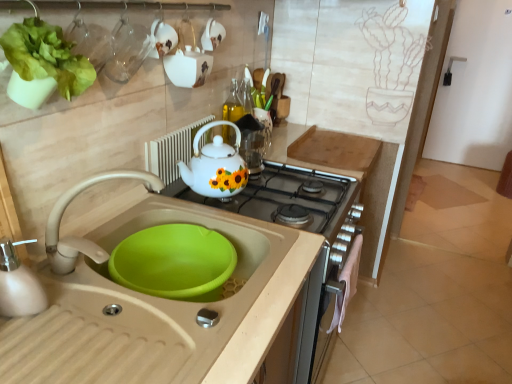
In order to face white matte soap dispenser at left, should I rotate leftwards or rightwards?

To align with it, rotate left about 29.166°.

Describe the element at coordinates (285, 196) in the screenshot. I see `white glossy gas stove at center` at that location.

In order to face white glossy teapot at upper center, the first appliance when ordered from top to bottom, should I rotate leftwards or rightwards?

Rotate left and turn 8.757 degrees.

The height and width of the screenshot is (384, 512). Describe the element at coordinates (172, 151) in the screenshot. I see `white ceramic teapot at upper center, placed as the 1th appliance when sorted from bottom to top` at that location.

Locate an element on the screen. The height and width of the screenshot is (384, 512). transparent glass cup at upper left is located at coordinates (127, 51).

At what (x,y) coordinates should I click in order to perform the action: click on white glossy teapot at center. Please return your answer as a coordinate pair (x, y). Image resolution: width=512 pixels, height=384 pixels. Looking at the image, I should click on (216, 166).

What is the approximate width of green leafy lettuce at upper left?

green leafy lettuce at upper left is 5.08 inches wide.

What do you see at coordinates (428, 321) in the screenshot? I see `beige tile at lower right` at bounding box center [428, 321].

Identify the location of white matte soap dispenser at left. The image size is (512, 384). (18, 284).

You are a GUI agent. You are given a task and a screenshot of the screen. Output one action in this format:
    pyautogui.click(x=<x>, y=<y>)
    Task: Click on the vegetable above the white matte soap dispenser at left (from a real-world perspective)
    The image size is (512, 384).
    Given the screenshot: What is the action you would take?
    pyautogui.click(x=46, y=56)

From the image's perspective, is white matte soap dispenser at left on top of green leafy lettuce at upper left?

No, from the image's perspective, white matte soap dispenser at left is not above green leafy lettuce at upper left.

How distant is white matte soap dispenser at left from green leafy lettuce at upper left?

white matte soap dispenser at left is 37.71 centimeters from green leafy lettuce at upper left.

From a real-world perspective, between white matte soap dispenser at left and green leafy lettuce at upper left, who is vertically higher?

In real-world perspective, green leafy lettuce at upper left is above.

Is point (233, 376) positioned behind point (180, 70)?

No.

Can you confirm if beige plastic sink at lower left is positioned to the left of white glossy teapot at upper center, the first appliance when ordered from top to bottom?

Correct, you'll find beige plastic sink at lower left to the left of white glossy teapot at upper center, the first appliance when ordered from top to bottom.

Image resolution: width=512 pixels, height=384 pixels. I want to click on appliance that is on the right side of beige plastic sink at lower left, so tap(187, 59).

Is beige plastic sink at lower left located outside white glossy teapot at upper center, the first appliance when ordered from top to bottom?

Yes, beige plastic sink at lower left is located beyond the bounds of white glossy teapot at upper center, the first appliance when ordered from top to bottom.

From the image's perspective, which is above, white matte soap dispenser at left or transparent glass cup at upper left?

transparent glass cup at upper left.

Does point (1, 246) appear closer or farther from the camera than point (119, 70)?

Point (1, 246) appears to be closer to the viewer than point (119, 70).

Would you say white matte soap dispenser at left is outside transparent glass cup at upper left?

white matte soap dispenser at left is positioned outside transparent glass cup at upper left.

Considering the sizes of white matte soap dispenser at left and transparent glass cup at upper left in the image, is white matte soap dispenser at left taller or shorter than transparent glass cup at upper left?

Clearly, white matte soap dispenser at left is shorter compared to transparent glass cup at upper left.

Considering the positions of objects beige tile at lower right and transparent glass cup at upper left in the image provided, who is more to the left, beige tile at lower right or transparent glass cup at upper left?

Positioned to the left is transparent glass cup at upper left.

Is beige tile at lower right oriented towards transparent glass cup at upper left?

No, beige tile at lower right is not oriented towards transparent glass cup at upper left.

From the image's perspective, which object appears higher, beige tile at lower right or transparent glass cup at upper left?

transparent glass cup at upper left, from the image's perspective.

Who is taller, beige tile at lower right or transparent glass cup at upper left?

transparent glass cup at upper left is taller.

Is white glossy teapot at upper center, the first appliance when ordered from top to bottom, facing away from beige plastic sink at lower left?

No, beige plastic sink at lower left is not at the back of white glossy teapot at upper center, the first appliance when ordered from top to bottom.

From a real-world perspective, is white glossy teapot at upper center, which is the second appliance in bottom-to-top order, beneath beige plastic sink at lower left?

No.

Are white glossy teapot at upper center, which is the second appliance in bottom-to-top order, and beige plastic sink at lower left beside each other?

No, white glossy teapot at upper center, which is the second appliance in bottom-to-top order, is not beside beige plastic sink at lower left.

How far apart are white glossy teapot at upper center, the first appliance when ordered from top to bottom, and beige plastic sink at lower left?

white glossy teapot at upper center, the first appliance when ordered from top to bottom, and beige plastic sink at lower left are 24.72 inches apart.

Can you confirm if beige tile at lower right is wider than matte beige faucet at sink left?

Correct, the width of beige tile at lower right exceeds that of matte beige faucet at sink left.

From a real-world perspective, who is located lower, beige tile at lower right or matte beige faucet at sink left?

beige tile at lower right, from a real-world perspective.

Is beige tile at lower right facing away from matte beige faucet at sink left?

That's not correct — beige tile at lower right is not looking away from matte beige faucet at sink left.

Could you tell me if white matte soap dispenser at left is turned towards matte beige faucet at sink left?

No, white matte soap dispenser at left is not turned towards matte beige faucet at sink left.

Does point (33, 284) lie in front of point (102, 180)?

Yes.

Do you think white matte soap dispenser at left is within matte beige faucet at sink left, or outside of it?

white matte soap dispenser at left is outside matte beige faucet at sink left.

Is white matte soap dispenser at left next to matte beige faucet at sink left and touching it?

No, white matte soap dispenser at left is not next to matte beige faucet at sink left.

Identify the location of kitchen appliance located below the green leafy lettuce at upper left (from the image's perspective). The height and width of the screenshot is (384, 512). (18, 284).

You are a GUI agent. You are given a task and a screenshot of the screen. Output one action in this format:
    pyautogui.click(x=<x>, y=<y>)
    Task: Click on the sink in front of the white glossy teapot at upper center, which is the second appliance in bottom-to-top order
    This screenshot has height=384, width=512.
    Given the screenshot: What is the action you would take?
    pyautogui.click(x=157, y=306)

From the picture: Which object lies nearer to the anchor point matte beige faucet at sink left, white ceramic teapot at upper center, placed as the 1th appliance when sorted from bottom to top, or white glossy teapot at center?

Based on the image, white glossy teapot at center appears to be nearer to matte beige faucet at sink left.

Looking at this image, when comparing their distances from beige plastic sink at lower left, does matte beige faucet at sink left or transparent glass cup at upper left seem further?

Based on the image, transparent glass cup at upper left appears to be further to beige plastic sink at lower left.

Looking at this image, which object lies further to the anchor point beige tile at lower right, matte beige faucet at sink left or beige plastic sink at lower left?

matte beige faucet at sink left is further to beige tile at lower right.

Looking at the image, which one is located further to beige plastic sink at lower left, matte beige faucet at sink left or green leafy lettuce at upper left?

The object further to beige plastic sink at lower left is green leafy lettuce at upper left.

Which object lies nearer to the anchor point white matte soap dispenser at left, white glossy gas stove at center or green leafy lettuce at upper left?

Based on the image, green leafy lettuce at upper left appears to be nearer to white matte soap dispenser at left.

Which object lies nearer to the anchor point beige plastic sink at lower left, beige tile at lower right or white glossy gas stove at center?

white glossy gas stove at center.

Looking at this image, when comparing their distances from matte beige faucet at sink left, does white ceramic teapot at upper center, placed as the 1th appliance when sorted from bottom to top, or beige plastic sink at lower left seem closer?

The object closer to matte beige faucet at sink left is beige plastic sink at lower left.

Based on their spatial positions, is white ceramic teapot at upper center, placed as the 1th appliance when sorted from bottom to top, or transparent glass cup at upper left closer to matte beige faucet at sink left?

transparent glass cup at upper left lies closer to matte beige faucet at sink left than the other object.

At what (x,y) coordinates should I click in order to perform the action: click on vegetable between beige plastic sink at lower left and white glossy gas stove at center along the z-axis. Please return your answer as a coordinate pair (x, y). Image resolution: width=512 pixels, height=384 pixels. Looking at the image, I should click on (46, 56).

Image resolution: width=512 pixels, height=384 pixels. In order to click on tableware between white matte soap dispenser at left and beige tile at lower right from left to right in this screenshot , I will do `click(127, 51)`.

This screenshot has height=384, width=512. I want to click on teapot located between beige plastic sink at lower left and beige tile at lower right in the left-right direction, so click(x=216, y=166).

Where is `tap between white glossy teapot at upper center, which is the second appliance in bottom-to-top order, and white matte soap dispenser at left vertically`? The image size is (512, 384). tap between white glossy teapot at upper center, which is the second appliance in bottom-to-top order, and white matte soap dispenser at left vertically is located at coordinates (79, 237).